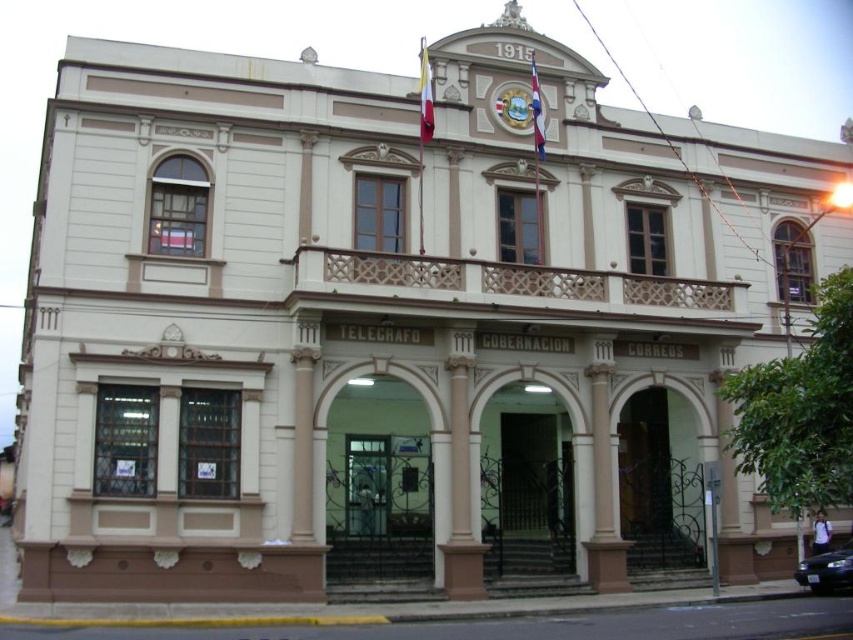
Question: Which of the following is the farthest from the observer?

Choices:
 (A) shiny black sedan at lower right
 (B) white marble column at center

Answer: (A)

Question: Is white marble column at center bigger than shiny black sedan at lower right?

Choices:
 (A) yes
 (B) no

Answer: (A)

Question: Where is white marble column at center located in relation to shiny black sedan at lower right in the image?

Choices:
 (A) above
 (B) below

Answer: (A)

Question: Is white marble column at center bigger than shiny black sedan at lower right?

Choices:
 (A) yes
 (B) no

Answer: (A)